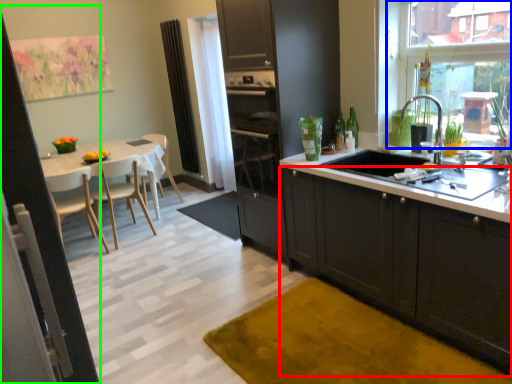
Question: Which is farther away from cabinetry (highlighted by a red box)? window screen (highlighted by a blue box) or screen door (highlighted by a green box)?

Choices:
 (A) window screen
 (B) screen door

Answer: (B)